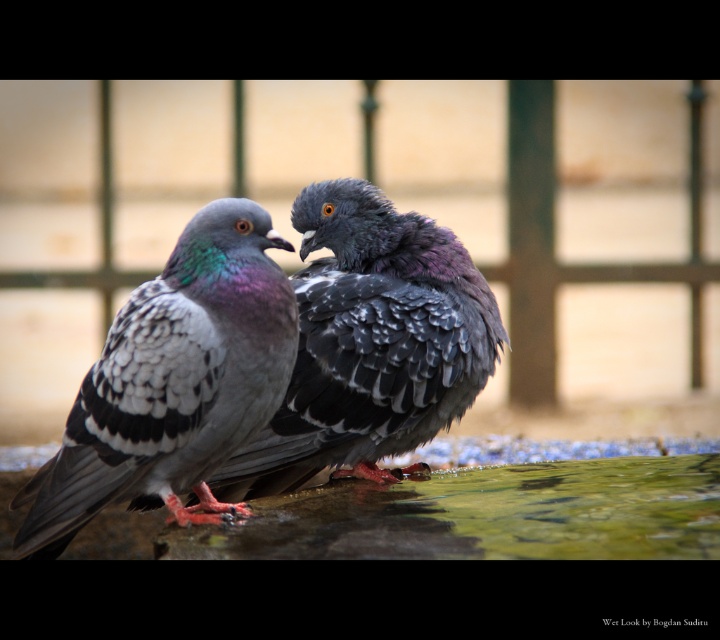
Who is positioned more to the left, speckled feathered pigeon at left or shiny gray feathers at center?

Positioned to the left is speckled feathered pigeon at left.

Is speckled feathered pigeon at left above shiny gray feathers at center?

No.

The image size is (720, 640). Describe the element at coordinates (174, 381) in the screenshot. I see `speckled feathered pigeon at left` at that location.

Find the location of a particular element. The height and width of the screenshot is (640, 720). speckled feathered pigeon at left is located at coordinates pyautogui.click(x=174, y=381).